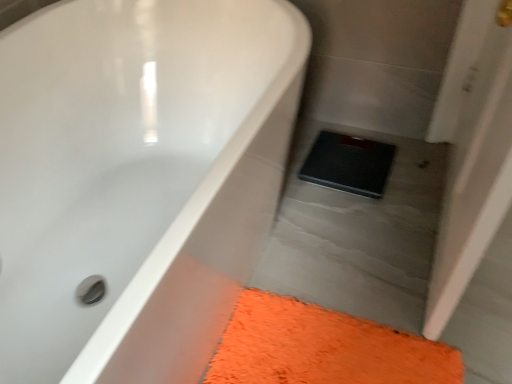
You are a GUI agent. You are given a task and a screenshot of the screen. Output one action in this format:
    pyautogui.click(x=<x>, y=<y>)
    Task: Click on the vacant area situated below orange shaggy bath mat at lower right (from a real-world perspective)
    The width and height of the screenshot is (512, 384).
    Given the screenshot: What is the action you would take?
    pyautogui.click(x=332, y=349)